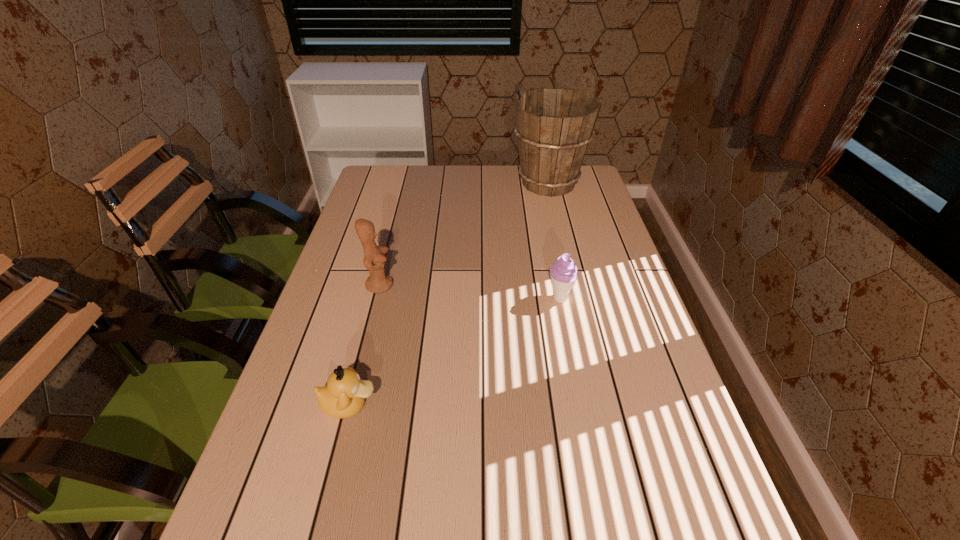
Where is `the farthest object`? This screenshot has height=540, width=960. the farthest object is located at coordinates (554, 126).

In order to click on the tallest object in this screenshot , I will do pyautogui.click(x=554, y=126).

You are a GUI agent. You are given a task and a screenshot of the screen. Output one action in this format:
    pyautogui.click(x=<x>, y=<y>)
    Task: Click on the third shortest object
    
    Given the screenshot: What is the action you would take?
    pyautogui.click(x=378, y=282)

Where is `the third tallest object`? the third tallest object is located at coordinates 563,272.

Where is `the shortest object`? The height and width of the screenshot is (540, 960). the shortest object is located at coordinates coord(343,397).

This screenshot has width=960, height=540. In order to click on duckling in this screenshot , I will do 343,397.

The height and width of the screenshot is (540, 960). Find the location of `vacant space located on the left of the bucket`. vacant space located on the left of the bucket is located at coordinates (451, 184).

At what (x,y) coordinates should I click in order to perform the action: click on blank space located on the front-facing side of the figurine. Please return your answer as a coordinate pair (x, y). This screenshot has height=540, width=960. Looking at the image, I should click on (471, 285).

This screenshot has height=540, width=960. Find the location of `vacant area located 0.150m on the front of the second shortest object`. vacant area located 0.150m on the front of the second shortest object is located at coordinates (571, 356).

You are a GUI agent. You are given a task and a screenshot of the screen. Output one action in this format:
    pyautogui.click(x=<x>, y=<y>)
    Task: Click on the vacant space situated on the face of the shortest object
    
    Given the screenshot: What is the action you would take?
    pyautogui.click(x=480, y=405)